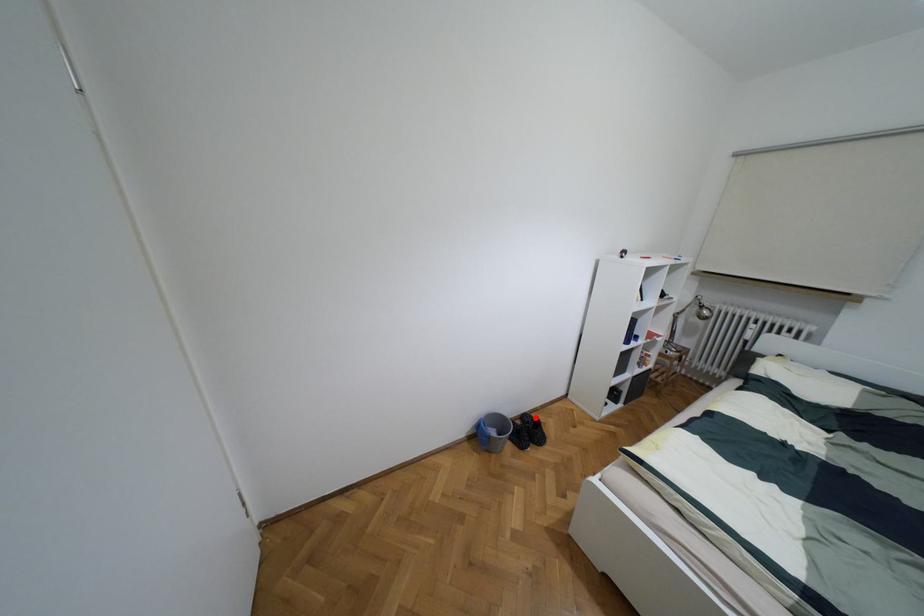
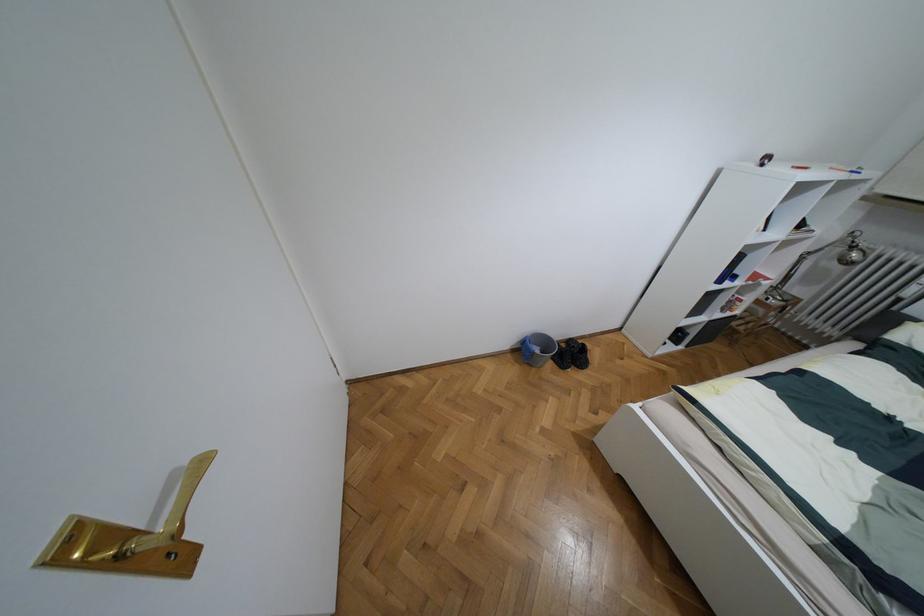
Find the pixel in the second image that matches the highlighted location in the first image.

(582, 344)